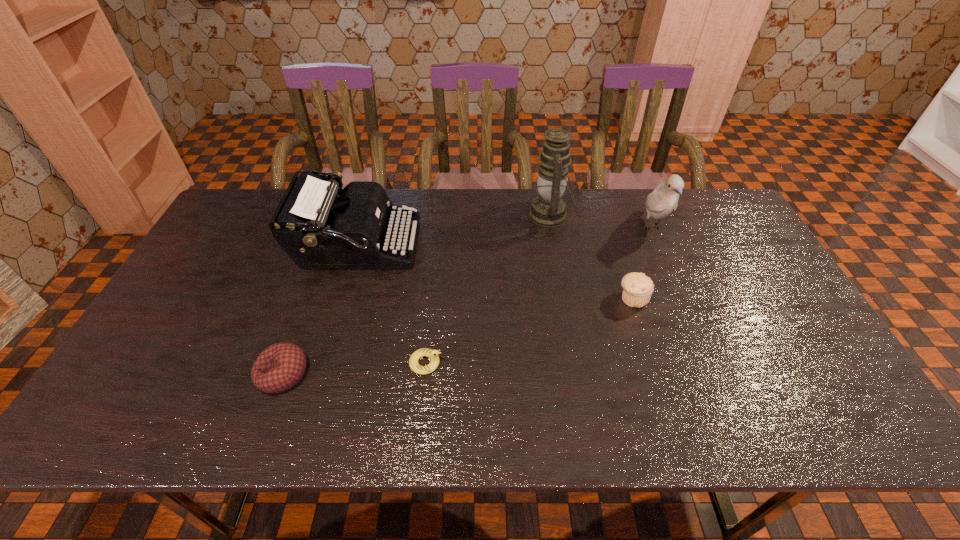
Where is `free spot at the left edge of the desktop`? This screenshot has height=540, width=960. free spot at the left edge of the desktop is located at coordinates (145, 375).

In the image, there is a desktop. Identify the location of vacant space at the right edge. (780, 329).

The height and width of the screenshot is (540, 960). What are the coordinates of `vacant space at the far left corner of the desktop` in the screenshot? It's located at (240, 220).

Where is `free space that is in between the third nearest object and the third tallest object`? This screenshot has height=540, width=960. free space that is in between the third nearest object and the third tallest object is located at coordinates (494, 272).

Find the location of a particular element. The width and height of the screenshot is (960, 540). free space that is in between the beanbag and the bird is located at coordinates (468, 301).

Identify the location of vacant space that's between the fifth object from left to right and the typewriter. The image size is (960, 540). (494, 272).

What are the coordinates of `unoccupied position between the bird and the beanbag` in the screenshot? It's located at (468, 301).

Locate an element on the screen. This screenshot has width=960, height=540. blank region between the beanbag and the rightmost object is located at coordinates (468, 301).

I want to click on vacant area between the muffin and the third tallest object, so click(494, 272).

This screenshot has height=540, width=960. What are the coordinates of `empty location between the fourth object from right to left and the muffin` in the screenshot? It's located at (529, 330).